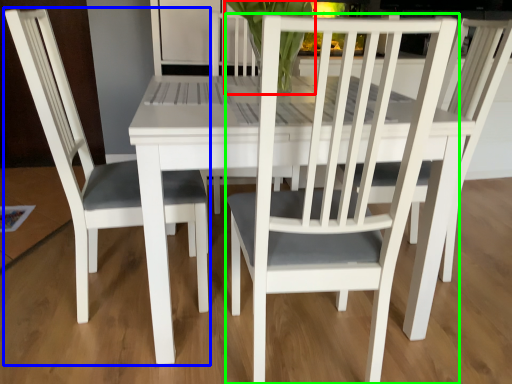
Question: Which object is positioned closest to orchid (highlighted by a red box)? Select from chair (highlighted by a blue box) and chair (highlighted by a green box).

Choices:
 (A) chair
 (B) chair

Answer: (A)